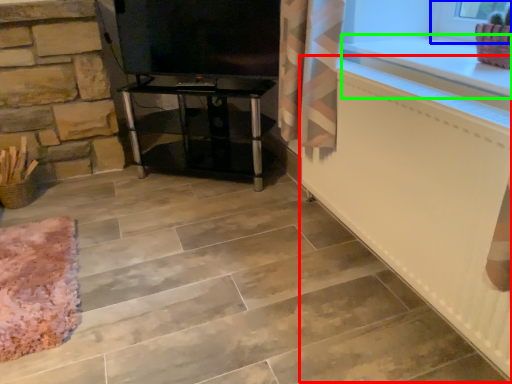
Question: Considering the real-world distances, which object is farthest from radiator (highlighted by a red box)? window frame (highlighted by a blue box) or counter top (highlighted by a green box)?

Choices:
 (A) window frame
 (B) counter top

Answer: (A)